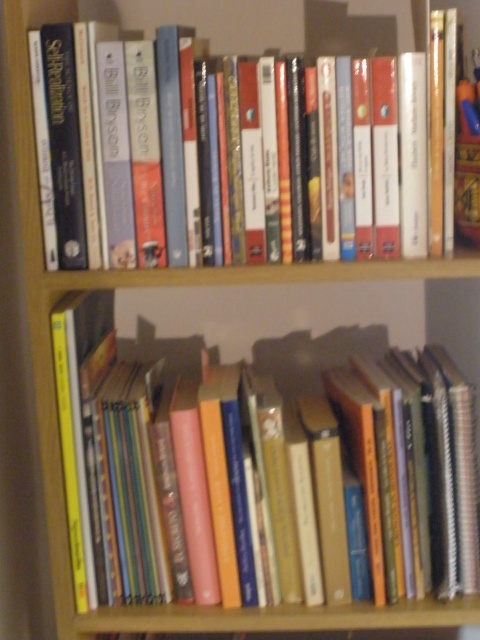
You are organizing books on a bookshelf and need to place a new book that requires a space taller than 10 cm. Looking at the hardcover book at center and the hardcover book at upper center, which one has a height suitable for your new book?

The hardcover book at center is much taller than the hardcover book at upper center, so it has a height suitable for the new book requiring more than 10 cm of space.

You are a librarian trying to organize the bottom shelf of the bookshelf. You have two hardcover books to place on the shelf. The hardcover book at center and the hardcover book at upper center are already there. What is the minimum distance you need to maintain between them to avoid overcrowding?

The distance between the hardcover book at center and the hardcover book at upper center is already 9.58 inches, so maintaining this distance or slightly more would prevent overcrowding.